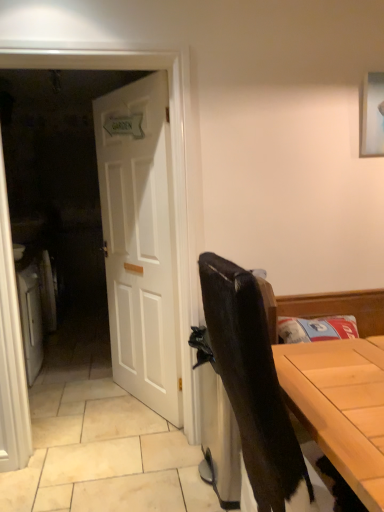
Question: Considering the positions of point (244, 367) and point (178, 232), is point (244, 367) closer or farther from the camera than point (178, 232)?

Choices:
 (A) farther
 (B) closer

Answer: (B)

Question: In terms of height, does matte black chair at right look taller or shorter compared to white wooden door at left?

Choices:
 (A) tall
 (B) short

Answer: (B)

Question: Estimate the real-world distances between objects in this image. Which object is closer to the white wooden door at left?

Choices:
 (A) white wooden door at center
 (B) matte black chair at right

Answer: (A)

Question: Estimate the real-world distances between objects in this image. Which object is farther from the white wooden door at left?

Choices:
 (A) matte black chair at right
 (B) white wooden door at center

Answer: (A)